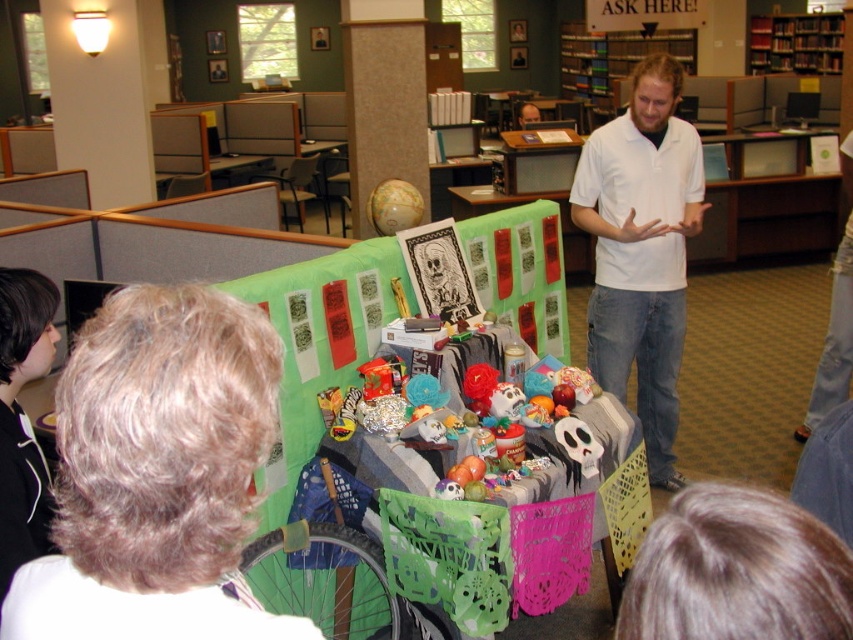
Does blonde hair at upper left appear under dark brown hair at lower right?

Indeed, blonde hair at upper left is positioned under dark brown hair at lower right.

Does blonde hair at upper left come behind dark brown hair at lower right?

Yes, it is.

Identify the location of blonde hair at upper left. This screenshot has height=640, width=853. (157, 474).

I want to click on blonde hair at upper left, so click(157, 474).

Which is below, blonde hair at upper left or black hoodie at lower left?

blonde hair at upper left

Is point (9, 611) positioned in front of point (32, 440)?

Yes.

Locate an element on the screen. This screenshot has width=853, height=640. blonde hair at upper left is located at coordinates (157, 474).

From the picture: Is blonde hair at upper left below white cotton shirt at center?

Indeed, blonde hair at upper left is positioned under white cotton shirt at center.

The width and height of the screenshot is (853, 640). I want to click on blonde hair at upper left, so pyautogui.click(x=157, y=474).

Is point (106, 634) closer to viewer compared to point (665, 380)?

Yes, point (106, 634) is closer to viewer.

Find the location of a particular element. Image resolution: width=853 pixels, height=640 pixels. blonde hair at upper left is located at coordinates (157, 474).